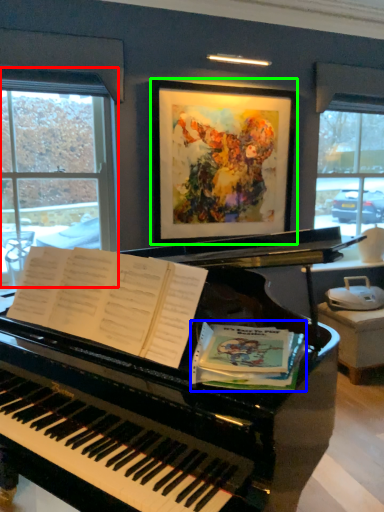
Question: Estimate the real-world distances between objects in this image. Which object is farther from window (highlighted by a red box), paperback book (highlighted by a blue box) or picture frame (highlighted by a green box)?

Choices:
 (A) paperback book
 (B) picture frame

Answer: (A)